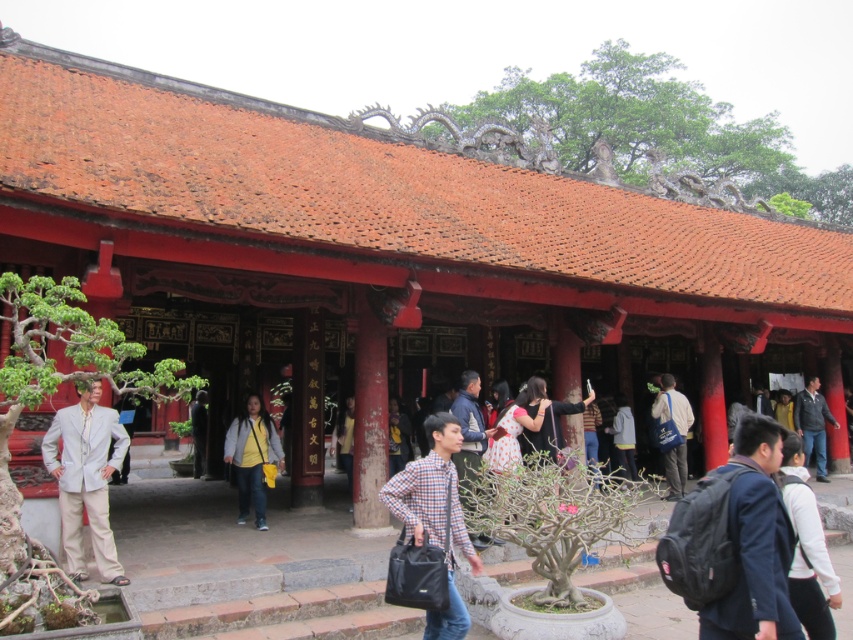
Is checkered fabric shirt at center closer to camera compared to yellow fabric at center?

Yes, checkered fabric shirt at center is in front of yellow fabric at center.

Who is taller, checkered fabric shirt at center or yellow fabric at center?

yellow fabric at center

Between point (451, 496) and point (346, 476), which one is positioned in front?

Point (451, 496)

You are a GUI agent. You are given a task and a screenshot of the screen. Output one action in this format:
    pyautogui.click(x=<x>, y=<y>)
    Task: Click on the checkered fabric shirt at center
    This screenshot has width=853, height=640.
    Given the screenshot: What is the action you would take?
    [x=432, y=492]

Can you confirm if white cotton shirt at center is wider than gray fleece jacket at center?

Correct, the width of white cotton shirt at center exceeds that of gray fleece jacket at center.

Can you confirm if white cotton shirt at center is positioned to the right of gray fleece jacket at center?

Incorrect, white cotton shirt at center is not on the right side of gray fleece jacket at center.

Is point (798, 506) closer to viewer compared to point (619, 461)?

Yes.

Locate an element on the screen. white cotton shirt at center is located at coordinates (805, 547).

I want to click on checkered fabric shirt at center, so click(x=432, y=492).

Between checkered fabric shirt at center and yellow fabric backpack at center, which one has less height?

checkered fabric shirt at center is shorter.

Is point (427, 534) more distant than point (233, 420)?

No.

Locate an element on the screen. Image resolution: width=853 pixels, height=640 pixels. checkered fabric shirt at center is located at coordinates (432, 492).